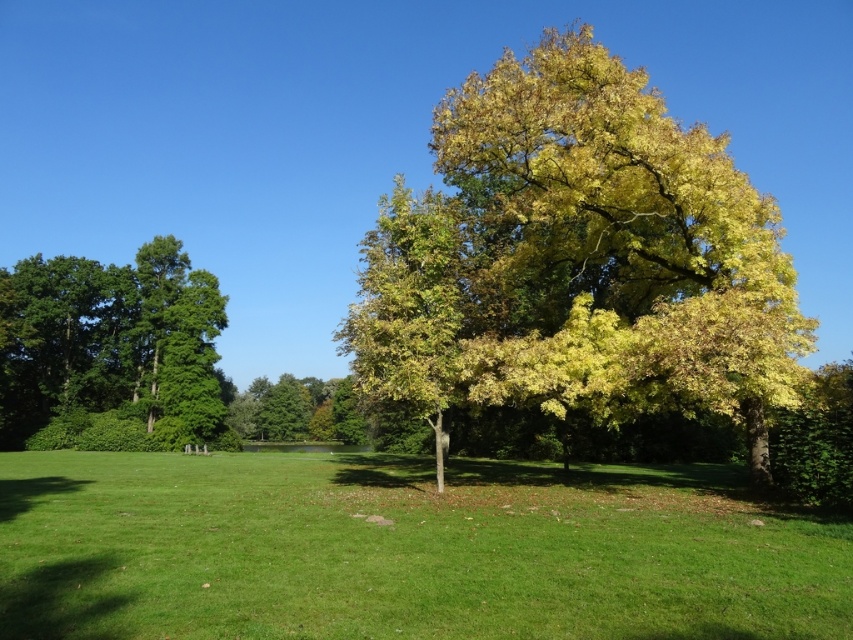
From the picture: You are planning to install a small garden path between the green leafy tree at left and the green leafy tree at center. The path requires a minimum of 30 meters of space. Based on the scene, will there be enough space between the two trees for the path?

The green leafy tree at left and green leafy tree at center are 29.71 meters apart from each other, which is less than the required 30 meters. Therefore, there isn not enough space for the path.

You are standing in the park and want to walk from point A to point B. Point A is at coordinate point (219, 636) and point B is at coordinate point (471, 211). According to the scene description, which point is closer to you when you are at the starting position?

Point A at coordinate point (219, 636) is closer to you because it is in front of point B at coordinate point (471, 211).